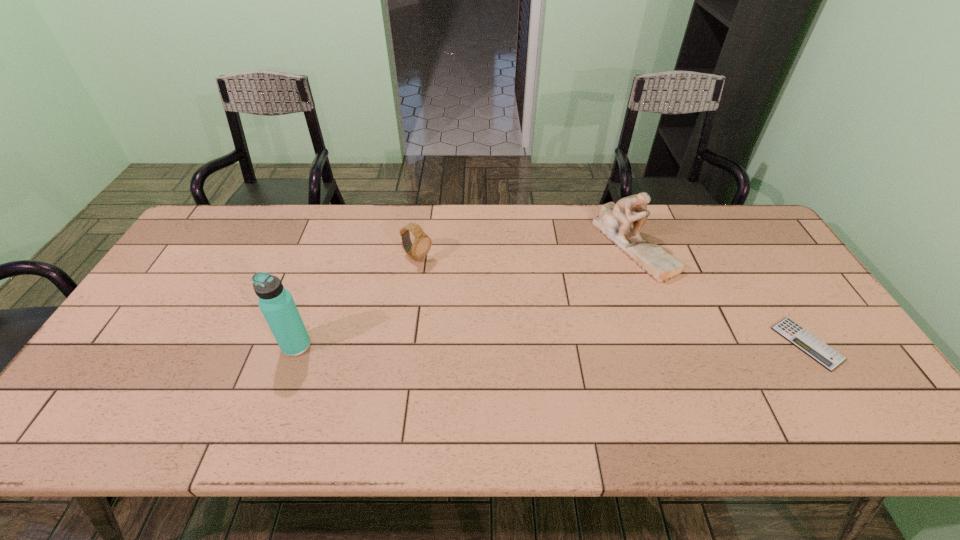
In order to click on blank area in the image that satisfies the following two spatial constraints: 1. on the front side of the calculator; 2. on the right side of the third tallest object in this screenshot , I will do `click(404, 343)`.

Identify the location of blank space that satisfies the following two spatial constraints: 1. on the back side of the second shortest object; 2. on the left side of the leftmost object. (328, 258).

You are a GUI agent. You are given a task and a screenshot of the screen. Output one action in this format:
    pyautogui.click(x=<x>, y=<y>)
    Task: Click on the free space that satisfies the following two spatial constraints: 1. on the back side of the thermos bottle; 2. on the right side of the figurine
    Image resolution: width=960 pixels, height=540 pixels.
    Given the screenshot: What is the action you would take?
    tap(333, 245)